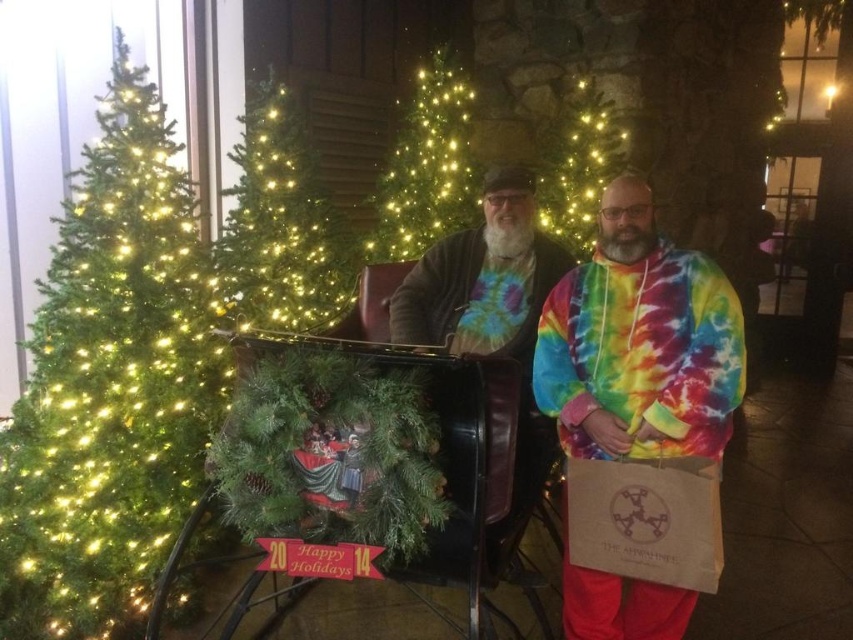
Is metallic black wagon at center taller than green matte christmas tree at center?

Indeed, metallic black wagon at center has a greater height compared to green matte christmas tree at center.

Who is more distant from viewer, (503, 376) or (567, 90)?

The point (567, 90) is more distant.

Does point (488, 476) come farther from viewer compared to point (540, 220)?

No, (488, 476) is in front of (540, 220).

Where is `metallic black wagon at center`? This screenshot has width=853, height=640. metallic black wagon at center is located at coordinates (454, 449).

Is tie-dye hoodie at center to the right of metallic black wagon at center from the viewer's perspective?

Indeed, tie-dye hoodie at center is positioned on the right side of metallic black wagon at center.

Between tie-dye hoodie at center and metallic black wagon at center, which one is positioned lower?

Positioned lower is metallic black wagon at center.

Between point (608, 636) and point (488, 547), which one is positioned in front?

Point (488, 547) is more forward.

This screenshot has height=640, width=853. What are the coordinates of `tie-dye hoodie at center` in the screenshot? It's located at (643, 340).

Can you confirm if illuminated green christmas tree at center is bigger than green matte christmas tree at center?

No, illuminated green christmas tree at center is not bigger than green matte christmas tree at center.

Does illuminated green christmas tree at center have a greater width compared to green matte christmas tree at center?

Yes.

You are a GUI agent. You are given a task and a screenshot of the screen. Output one action in this format:
    pyautogui.click(x=<x>, y=<y>)
    Task: Click on the illuminated green christmas tree at center
    Image resolution: width=853 pixels, height=640 pixels.
    Given the screenshot: What is the action you would take?
    pyautogui.click(x=426, y=164)